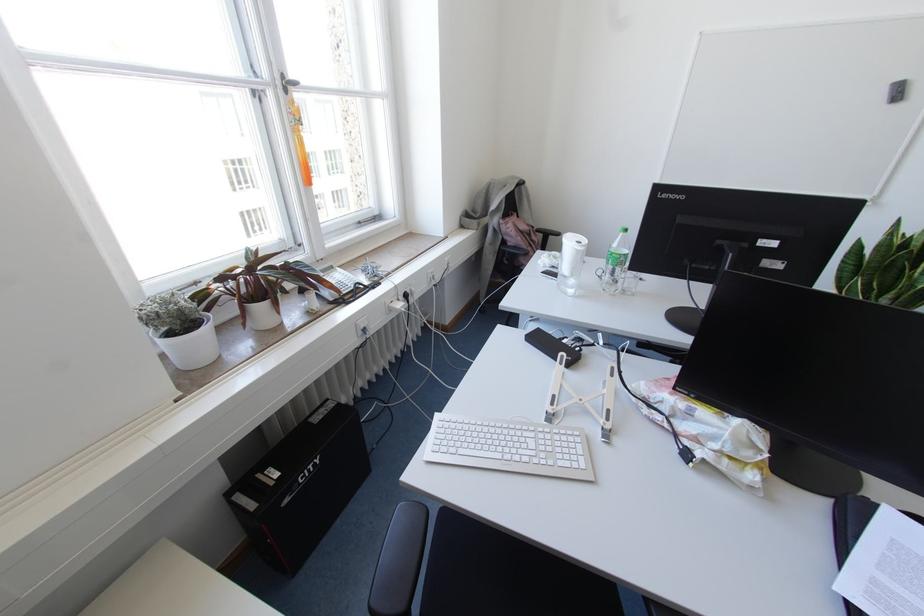
Find the location of a particular element. Image resolution: width=924 pixels, height=616 pixels. chair sitting surface is located at coordinates (483, 572).